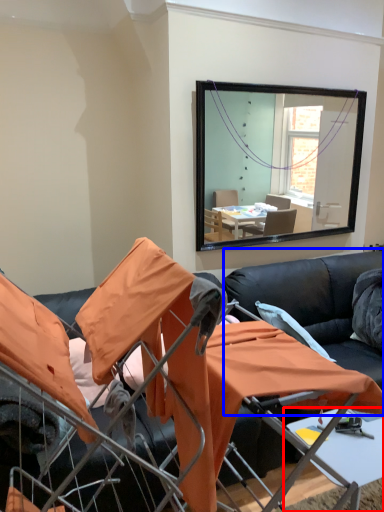
Question: Which object appears farthest to the camera in this image, table (highlighted by a red box) or couch (highlighted by a blue box)?

Choices:
 (A) table
 (B) couch

Answer: (B)